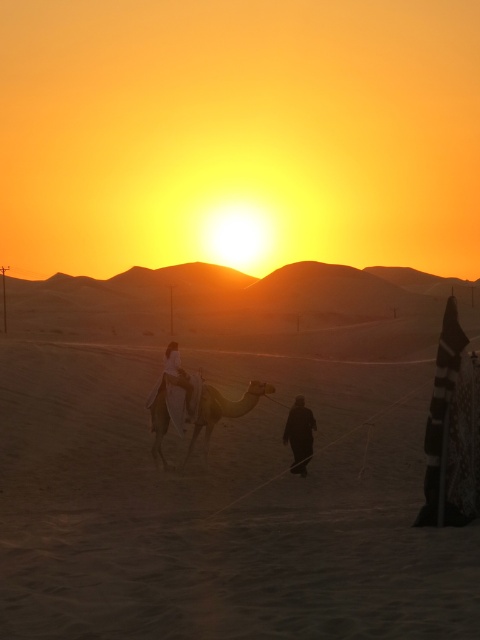
Locate an element on the screen. The width and height of the screenshot is (480, 640). brown textured camel at center is located at coordinates (222, 408).

Locate an element on the screen. Image resolution: width=480 pixels, height=640 pixels. brown textured camel at center is located at coordinates (222, 408).

Is sandy beige sand at center shorter than dark matte person at center?

In fact, sandy beige sand at center may be taller than dark matte person at center.

Is sandy beige sand at center to the right of dark matte person at center from the viewer's perspective?

No, sandy beige sand at center is not to the right of dark matte person at center.

What do you see at coordinates (219, 508) in the screenshot?
I see `sandy beige sand at center` at bounding box center [219, 508].

Where is `sandy beige sand at center`? sandy beige sand at center is located at coordinates (219, 508).

Is point (301, 413) in front of point (180, 364)?

That is False.

Find the location of a particular element. dark matte person at center is located at coordinates (300, 435).

Does point (284, 429) come in front of point (176, 360)?

No, it is not.

Where is `dark matte person at center`? dark matte person at center is located at coordinates (300, 435).